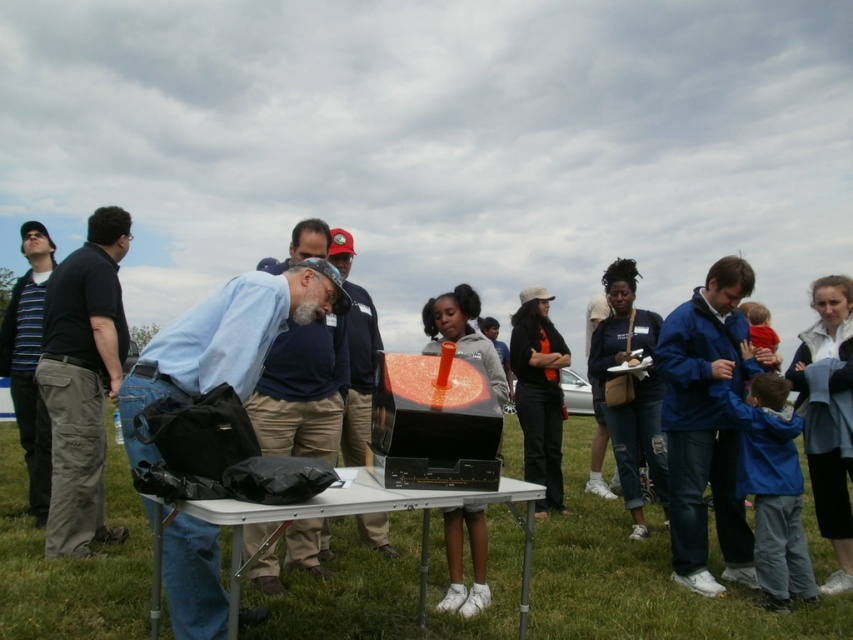
You are a photographer at the event and want to capture a photo where both the blue fabric shirt at center and the striped knit sweater at left are clearly visible. Since you want to ensure both are in focus, which one should you focus on first to maximize the depth of field?

You should focus on the striped knit sweater at left first because it is farther away from the viewer than the blue fabric shirt at center, allowing the depth of field to cover both subjects effectively.